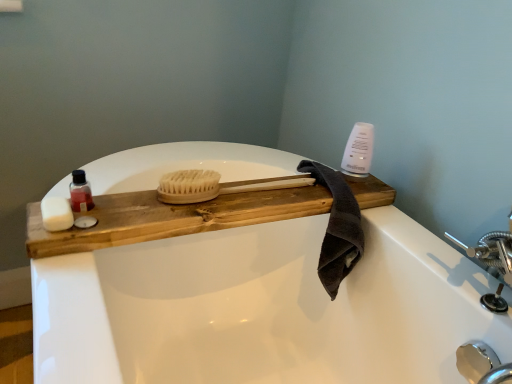
How much space does white matte soap at left, which appears as the first soap when viewed from the left, occupy vertically?

It is 3.06 centimeters.

What do you see at coordinates (173, 217) in the screenshot? I see `natural wood tray at center` at bounding box center [173, 217].

This screenshot has height=384, width=512. Describe the element at coordinates (80, 192) in the screenshot. I see `translucent plastic bottle at left` at that location.

Image resolution: width=512 pixels, height=384 pixels. Find the location of `dark gray cotton towel at upper right`. dark gray cotton towel at upper right is located at coordinates (337, 228).

Where is `polished chrome faucet at lower right`? This screenshot has width=512, height=384. polished chrome faucet at lower right is located at coordinates (476, 360).

From the picture: Are polished chrome faucet at lower right and white matte soap at left, which appears as the first soap when viewed from the left, located far from each other?

Yes, polished chrome faucet at lower right and white matte soap at left, which appears as the first soap when viewed from the left, are located far from each other.

From the image's perspective, relative to white matte soap at left, arranged as the second soap when viewed from the right, is polished chrome faucet at lower right above or below?

polished chrome faucet at lower right is below white matte soap at left, arranged as the second soap when viewed from the right.

In the image, there is a white matte soap at left, arranged as the second soap when viewed from the right. At what (x,y) coordinates should I click in order to perform the action: click on faucet below it (from the image's perspective). Please return your answer as a coordinate pair (x, y). The height and width of the screenshot is (384, 512). Looking at the image, I should click on (476, 360).

Is polished chrome faucet at lower right outside of white matte soap at left, which appears as the first soap when viewed from the left?

polished chrome faucet at lower right lies outside white matte soap at left, which appears as the first soap when viewed from the left,'s area.

From a real-world perspective, who is located higher, white matte soap at left, placed as the first soap when sorted from right to left, or white matte soap at left, arranged as the second soap when viewed from the right?

white matte soap at left, arranged as the second soap when viewed from the right, from a real-world perspective.

Are white matte soap at left, marked as the 2th soap in a left-to-right arrangement, and white matte soap at left, which appears as the first soap when viewed from the left, far apart?

That's not correct — white matte soap at left, marked as the 2th soap in a left-to-right arrangement, is a little close to white matte soap at left, which appears as the first soap when viewed from the left.

In the scene shown: Which is more to the right, white matte soap at left, placed as the first soap when sorted from right to left, or white matte soap at left, which appears as the first soap when viewed from the left?

Positioned to the right is white matte soap at left, placed as the first soap when sorted from right to left.

Which is less distant, (77,225) or (55,200)?

Point (77,225) is closer to the camera than point (55,200).

In terms of width, does white matte soap at left, placed as the first soap when sorted from right to left, look wider or thinner when compared to polished chrome faucet at lower right?

Considering their sizes, white matte soap at left, placed as the first soap when sorted from right to left, looks slimmer than polished chrome faucet at lower right.

Between white matte soap at left, placed as the first soap when sorted from right to left, and polished chrome faucet at lower right, which one has larger size?

polished chrome faucet at lower right is bigger.

Is white matte soap at left, marked as the 2th soap in a left-to-right arrangement, aimed at polished chrome faucet at lower right?

No, white matte soap at left, marked as the 2th soap in a left-to-right arrangement, is not aimed at polished chrome faucet at lower right.

Does point (80, 225) come closer to viewer compared to point (463, 368)?

Yes, point (80, 225) is closer to viewer.

At what (x,y) coordinates should I click in order to perform the action: click on cleaning product above the translucent plastic bottle at left (from the image's perspective). Please return your answer as a coordinate pair (x, y). This screenshot has width=512, height=384. Looking at the image, I should click on (358, 151).

Between translucent plastic bottle at left and white glossy bottle at upper right, which one has larger width?

white glossy bottle at upper right is wider.

Which is behind, point (85, 194) or point (364, 167)?

The point (364, 167) is more distant.

Is white glossy bottle at upper right surrounded by translucent plastic bottle at left?

No, white glossy bottle at upper right is located outside of translucent plastic bottle at left.

Where is `toiletry located on the left of white matte soap at left, placed as the first soap when sorted from right to left`? toiletry located on the left of white matte soap at left, placed as the first soap when sorted from right to left is located at coordinates (80, 192).

Is translucent plastic bottle at left inside the boundaries of white matte soap at left, marked as the 2th soap in a left-to-right arrangement, or outside?

translucent plastic bottle at left cannot be found inside white matte soap at left, marked as the 2th soap in a left-to-right arrangement.

Between point (79, 197) and point (82, 222), which one is positioned in front?

Positioned in front is point (82, 222).

From the image's perspective, which is below, translucent plastic bottle at left or white matte soap at left, marked as the 2th soap in a left-to-right arrangement?

From the image's view, white matte soap at left, marked as the 2th soap in a left-to-right arrangement, is below.

Is white matte soap at left, arranged as the second soap when viewed from the right, looking in the opposite direction of polished chrome faucet at lower right?

No, white matte soap at left, arranged as the second soap when viewed from the right,'s orientation is not away from polished chrome faucet at lower right.

Consider the image. How many degrees apart are the facing directions of white matte soap at left, arranged as the second soap when viewed from the right, and polished chrome faucet at lower right?

1.65 degrees separate the facing orientations of white matte soap at left, arranged as the second soap when viewed from the right, and polished chrome faucet at lower right.

Can you confirm if white matte soap at left, arranged as the second soap when viewed from the right, is shorter than polished chrome faucet at lower right?

Correct, white matte soap at left, arranged as the second soap when viewed from the right, is not as tall as polished chrome faucet at lower right.

How far apart are white matte soap at left, arranged as the second soap when viewed from the right, and polished chrome faucet at lower right?

white matte soap at left, arranged as the second soap when viewed from the right, is 4.05 feet from polished chrome faucet at lower right.

At what (x,y) coordinates should I click in order to perform the action: click on cleaning product on the right of dark gray cotton towel at upper right. Please return your answer as a coordinate pair (x, y). Looking at the image, I should click on (358, 151).

In the scene shown: From the image's perspective, does dark gray cotton towel at upper right appear higher than white glossy bottle at upper right?

Incorrect, from the image's perspective, dark gray cotton towel at upper right is lower than white glossy bottle at upper right.

Is white glossy bottle at upper right at the back of dark gray cotton towel at upper right?

No, white glossy bottle at upper right is not at the back of dark gray cotton towel at upper right.

From a real-world perspective, which object stands above the other?

In real-world perspective, white glossy bottle at upper right is above.

This screenshot has width=512, height=384. In order to click on faucet located underneath the white matte soap at left, arranged as the second soap when viewed from the right (from a real-world perspective) in this screenshot , I will do `click(476, 360)`.

You are a GUI agent. You are given a task and a screenshot of the screen. Output one action in this format:
    pyautogui.click(x=<x>, y=<y>)
    Task: Click on the soap on the right side of white matte soap at left, arranged as the second soap when viewed from the right
    The image size is (512, 384).
    Given the screenshot: What is the action you would take?
    pyautogui.click(x=85, y=222)

Based on their spatial positions, is dark gray cotton towel at upper right or polished chrome faucet at lower right further from translucent plastic bottle at left?

polished chrome faucet at lower right lies further to translucent plastic bottle at left than the other object.

Estimate the real-world distances between objects in this image. Which object is further from natural wood brush at center, white glossy bottle at upper right or translucent plastic bottle at left?

translucent plastic bottle at left is positioned further to the anchor natural wood brush at center.

Looking at this image, when comparing their distances from dark gray cotton towel at upper right, does natural wood tray at center or white glossy bottle at upper right seem closer?

Among the two, white glossy bottle at upper right is located nearer to dark gray cotton towel at upper right.

Estimate the real-world distances between objects in this image. Which object is further from polished chrome faucet at lower right, natural wood brush at center or translucent plastic bottle at left?

translucent plastic bottle at left lies further to polished chrome faucet at lower right than the other object.

Looking at the image, which one is located closer to dark gray cotton towel at upper right, polished chrome faucet at lower right or natural wood brush at center?

The object closer to dark gray cotton towel at upper right is natural wood brush at center.

Considering their positions, is polished chrome faucet at lower right positioned further to white matte soap at left, which appears as the first soap when viewed from the left, than natural wood tray at center?

Among the two, polished chrome faucet at lower right is located further to white matte soap at left, which appears as the first soap when viewed from the left.

Which object lies nearer to the anchor point white matte soap at left, arranged as the second soap when viewed from the right, white matte soap at left, placed as the first soap when sorted from right to left, or polished chrome faucet at lower right?

Among the two, white matte soap at left, placed as the first soap when sorted from right to left, is located nearer to white matte soap at left, arranged as the second soap when viewed from the right.

Which object lies nearer to the anchor point white matte soap at left, arranged as the second soap when viewed from the right, dark gray cotton towel at upper right or natural wood tray at center?

Among the two, natural wood tray at center is located nearer to white matte soap at left, arranged as the second soap when viewed from the right.

Where is `bath towel between white matte soap at left, arranged as the second soap when viewed from the right, and polished chrome faucet at lower right`? This screenshot has width=512, height=384. bath towel between white matte soap at left, arranged as the second soap when viewed from the right, and polished chrome faucet at lower right is located at coordinates (337, 228).

The image size is (512, 384). Identify the location of bath towel situated between natural wood tray at center and polished chrome faucet at lower right from left to right. (337, 228).

Where is `brush situated between translucent plastic bottle at left and polished chrome faucet at lower right from left to right`? Image resolution: width=512 pixels, height=384 pixels. brush situated between translucent plastic bottle at left and polished chrome faucet at lower right from left to right is located at coordinates 218,186.

This screenshot has height=384, width=512. I want to click on cleaning product between natural wood tray at center and polished chrome faucet at lower right in the horizontal direction, so click(x=358, y=151).